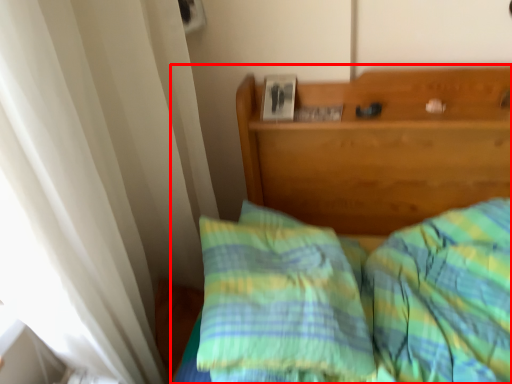
Question: From the image's perspective, what is the correct spatial positioning of bed (annotated by the red box) in reference to pillow?

Choices:
 (A) above
 (B) below

Answer: (B)